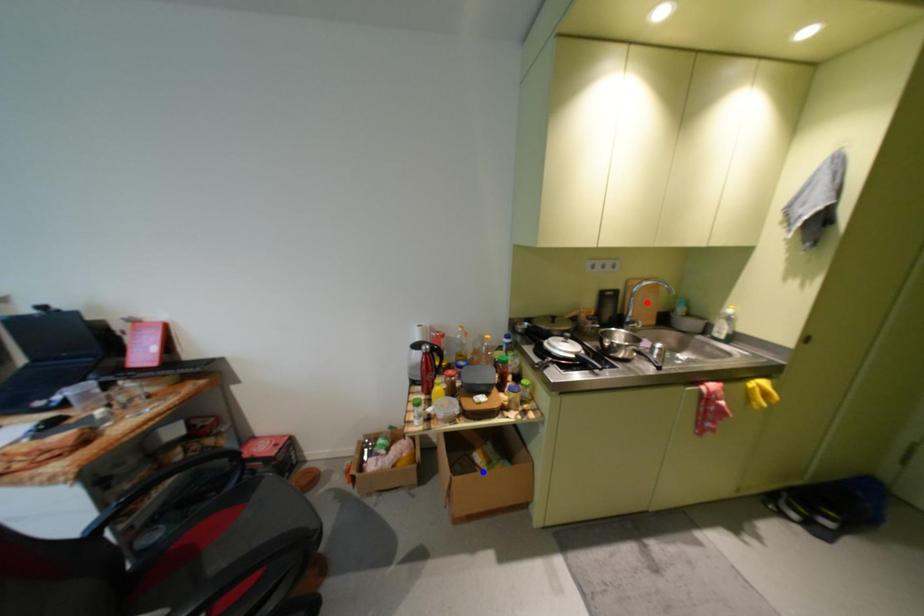
Question: Two points are marked on the image. Which point is closer to the camera?

Choices:
 (A) Blue point is closer.
 (B) Red point is closer.

Answer: (A)